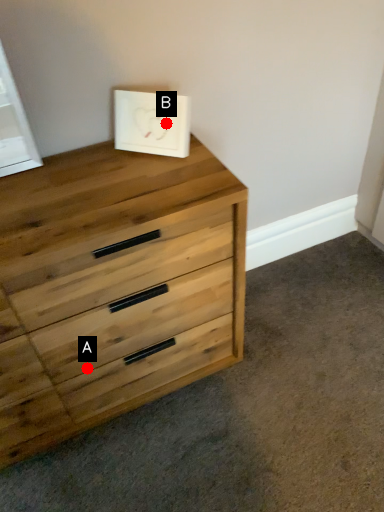
Question: Two points are circled on the image, labeled by A and B beside each circle. Which point is closer to the camera?

Choices:
 (A) A is closer
 (B) B is closer

Answer: (B)